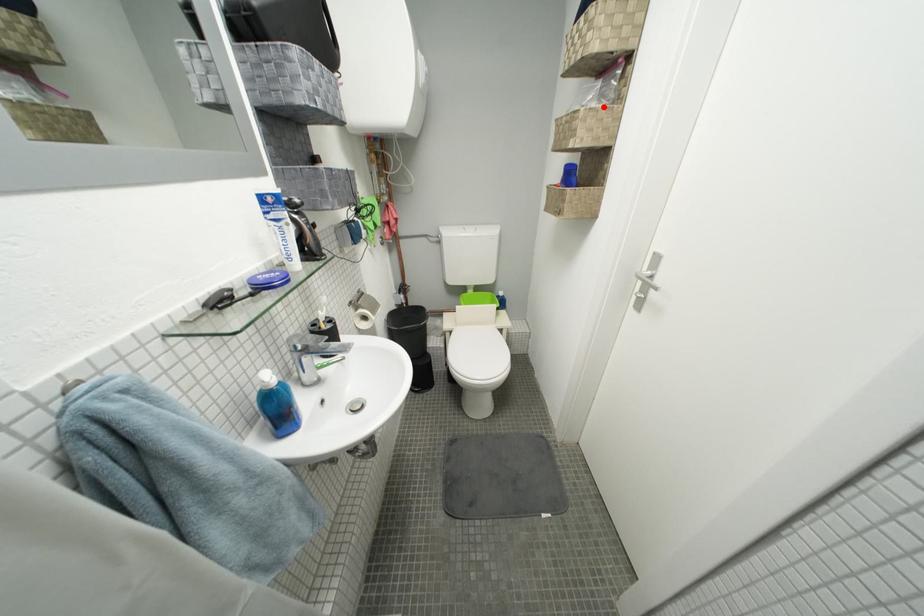
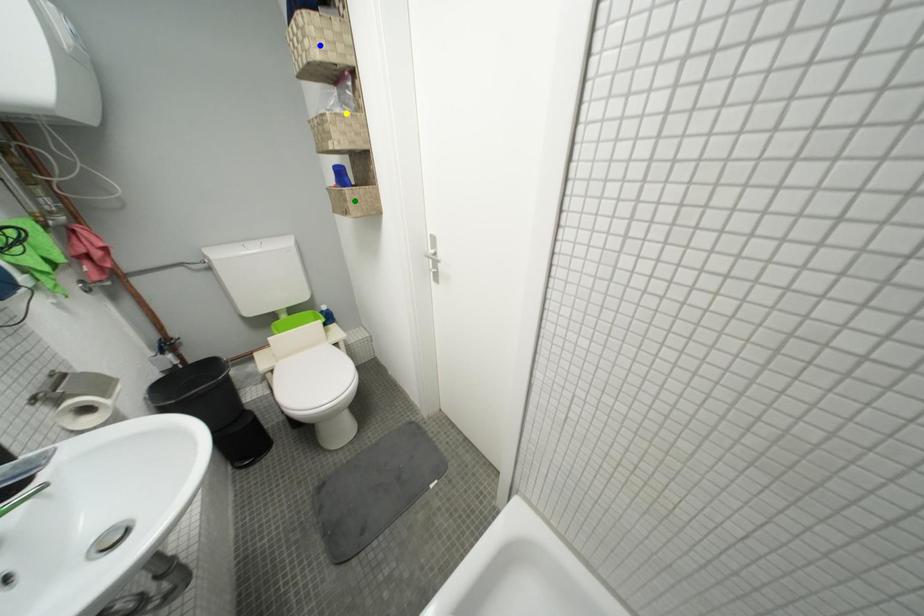
Question: I am providing you with two images of the same scene from different viewpoints. A red point is marked on the first image. You are given multiple points on the second image. Can you choose the point in image 2 that corresponds to the point in image 1?

Choices:
 (A) green point
 (B) yellow point
 (C) blue point

Answer: (B)